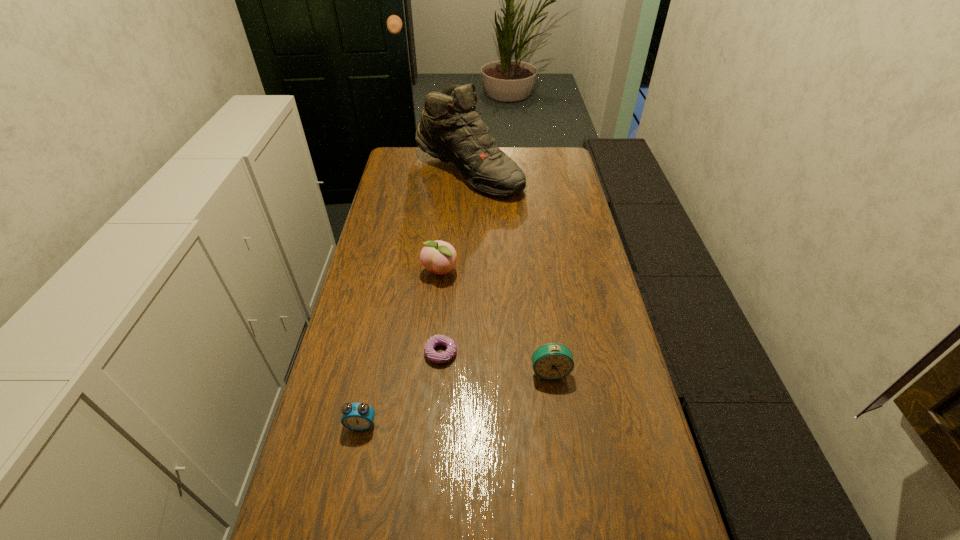
Locate an element on the screen. the tallest object is located at coordinates pyautogui.click(x=451, y=129).

In order to click on the farthest object in this screenshot , I will do `click(451, 129)`.

You are a GUI agent. You are given a task and a screenshot of the screen. Output one action in this format:
    pyautogui.click(x=<x>, y=<y>)
    Task: Click on the second farthest object
    This screenshot has height=540, width=960.
    Given the screenshot: What is the action you would take?
    pyautogui.click(x=439, y=257)

The width and height of the screenshot is (960, 540). Identify the location of the right alarm clock. (552, 361).

Identify the location of the taller alarm clock. (552, 361).

This screenshot has width=960, height=540. Identify the location of the nearer alarm clock. (355, 416).

Locate an element on the screen. The height and width of the screenshot is (540, 960). the nearest object is located at coordinates click(x=355, y=416).

You are a GUI agent. You are given a task and a screenshot of the screen. Output one action in this format:
    pyautogui.click(x=<x>, y=<y>)
    Task: Click on the doughnut
    The height and width of the screenshot is (540, 960).
    Given the screenshot: What is the action you would take?
    pyautogui.click(x=436, y=340)

You are a GUI agent. You are given a task and a screenshot of the screen. Output one action in this format:
    pyautogui.click(x=<x>, y=<y>)
    Task: Click on the vacant space located 0.220m on the front of the farthest object
    
    Given the screenshot: What is the action you would take?
    pyautogui.click(x=466, y=238)

Where is `free space located on the back of the peach`? The width and height of the screenshot is (960, 540). free space located on the back of the peach is located at coordinates (446, 198).